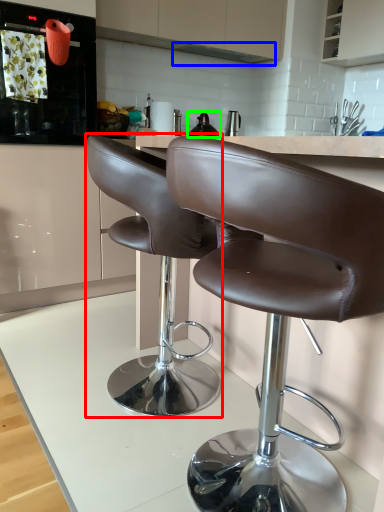
Question: Which is farther away from chair (highlighted by a red box)? exhaust hood (highlighted by a blue box) or tea pot (highlighted by a green box)?

Choices:
 (A) exhaust hood
 (B) tea pot

Answer: (A)